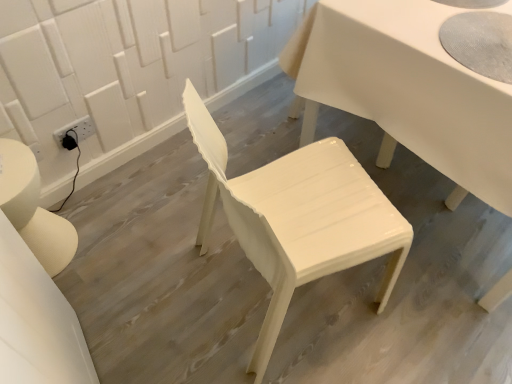
Question: From a real-world perspective, is glossy white chair at center positioned above or below glossy white table at center?

Choices:
 (A) above
 (B) below

Answer: (A)

Question: Considering the positions of point (330, 271) and point (442, 100), is point (330, 271) closer or farther from the camera than point (442, 100)?

Choices:
 (A) farther
 (B) closer

Answer: (B)

Question: From the image's perspective, is glossy white chair at center located above or below glossy white table at center?

Choices:
 (A) above
 (B) below

Answer: (B)

Question: From a real-world perspective, relative to glossy white chair at center, is glossy white table at center vertically above or below?

Choices:
 (A) above
 (B) below

Answer: (B)

Question: Is glossy white table at center to the left or to the right of glossy white chair at center in the image?

Choices:
 (A) right
 (B) left

Answer: (A)

Question: Would you say glossy white table at center is inside or outside glossy white chair at center?

Choices:
 (A) outside
 (B) inside

Answer: (A)

Question: Looking at the image, does glossy white table at center seem bigger or smaller compared to glossy white chair at center?

Choices:
 (A) small
 (B) big

Answer: (B)